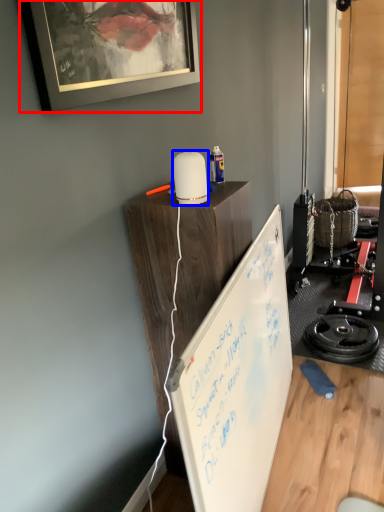
Question: Among these objects, which one is farthest to the camera, picture frame (highlighted by a red box) or appliance (highlighted by a blue box)?

Choices:
 (A) picture frame
 (B) appliance

Answer: (B)